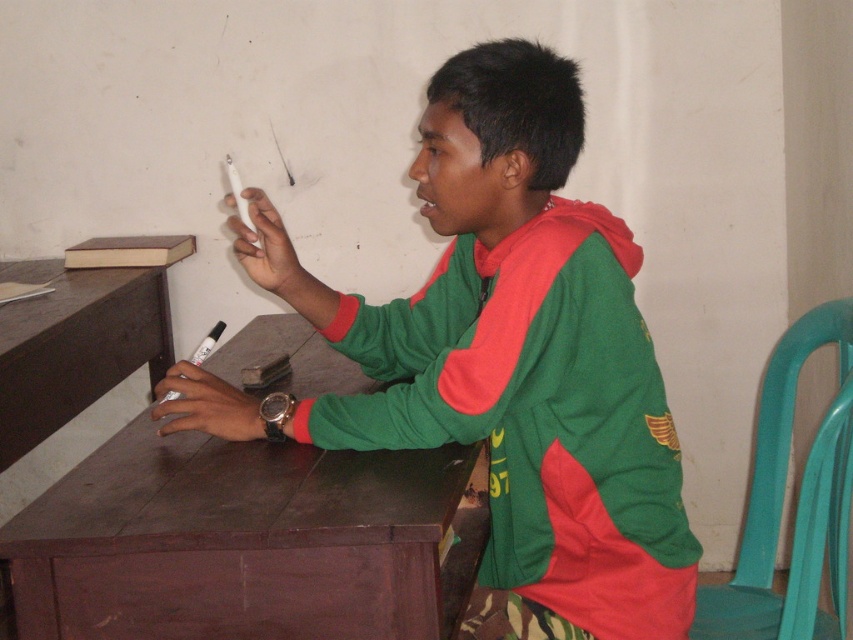
Question: Estimate the real-world distances between objects in this image. Which object is closer to the brown wood table at left?

Choices:
 (A) brown wood table at center
 (B) green matte jacket at center

Answer: (A)

Question: Is brown wood table at center to the right of brown wood table at left from the viewer's perspective?

Choices:
 (A) yes
 (B) no

Answer: (A)

Question: Which point appears closest to the camera in this image?

Choices:
 (A) pos(318,628)
 (B) pos(509,396)
 (C) pos(68,374)

Answer: (A)

Question: Is green matte jacket at center positioned in front of brown wood table at center?

Choices:
 (A) no
 (B) yes

Answer: (A)

Question: Is brown wood table at center closer to camera compared to brown wood table at left?

Choices:
 (A) no
 (B) yes

Answer: (B)

Question: Which object appears closest to the camera in this image?

Choices:
 (A) brown wood table at center
 (B) brown wood table at left
 (C) green matte jacket at center

Answer: (A)